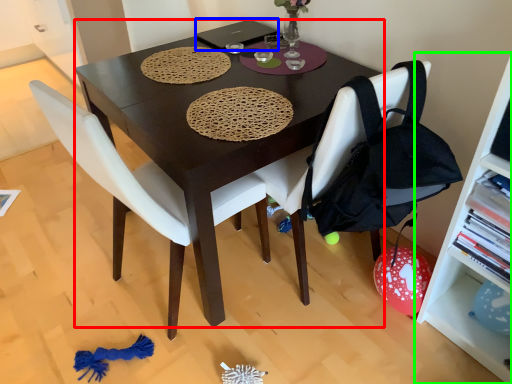
Question: Which object is positioned closest to desk (highlighted by a red box)? Select from laptop (highlighted by a blue box) and shelf (highlighted by a green box).

Choices:
 (A) laptop
 (B) shelf

Answer: (A)